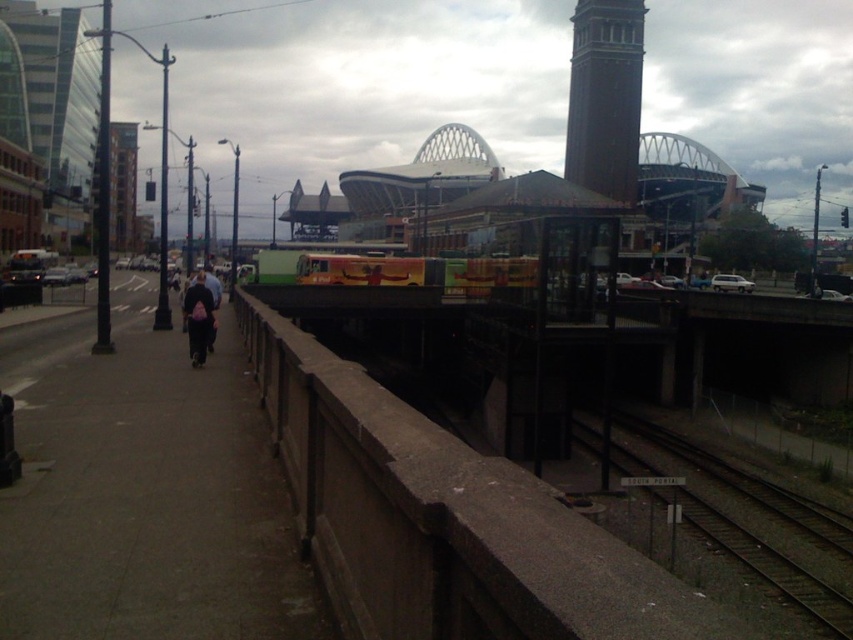
Question: Which of the following is the closest to the observer?

Choices:
 (A) dark blue jeans at center
 (B) dark gray metal train track at lower right

Answer: (B)

Question: Which object is the farthest from the dark gray metal train track at lower right?

Choices:
 (A) brown brick bell tower at upper center
 (B) dark blue jeans at center

Answer: (A)

Question: Is brown brick bell tower at upper center to the right of dark gray metal train track at lower right from the viewer's perspective?

Choices:
 (A) yes
 (B) no

Answer: (A)

Question: Does brown brick bell tower at upper center have a greater width compared to dark gray metal train track at lower right?

Choices:
 (A) no
 (B) yes

Answer: (B)

Question: Is brown brick bell tower at upper center bigger than dark blue jeans at center?

Choices:
 (A) no
 (B) yes

Answer: (B)

Question: Among these objects, which one is nearest to the camera?

Choices:
 (A) dark gray metal train track at lower right
 (B) brown brick bell tower at upper center

Answer: (A)